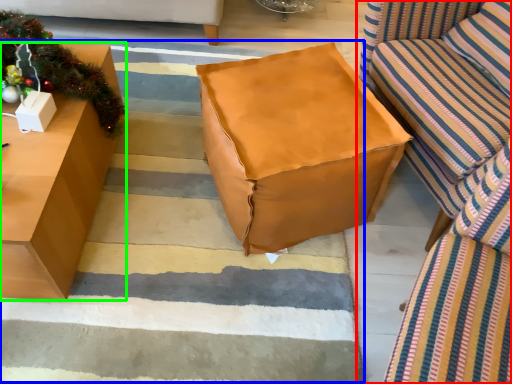
Question: Which object is the closest to the studio couch (highlighted by a red box)? Choose among these: stair (highlighted by a blue box) or table (highlighted by a green box).

Choices:
 (A) stair
 (B) table

Answer: (A)